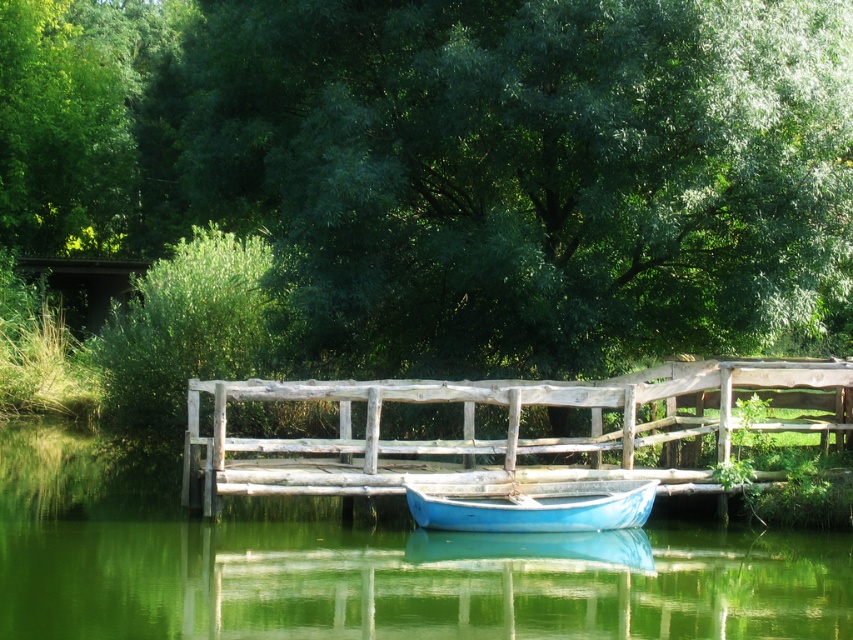
You are an artist planning to paint the scene. The green leafy tree at upper left and the matte blue boat at center are both in your view. Which object should you focus on first if you want to paint the larger one first?

The matte blue boat at center should be painted first because it occupies more space than the green leafy tree at upper left.

You are standing on the wooden bridge and looking down at the water. You see two points marked on the water surface. Which point is closer to you, point (135, 179) or point (508, 509)?

Point (135, 179) is closer to you because it is further to the viewer than point (508, 509).

You are an artist planning to paint the scene. You want to ensure the green leafy tree at upper center and the green leafy tree at upper left are proportionally accurate. Which tree should you draw wider in your painting?

The green leafy tree at upper center should be drawn wider because its width is larger than the green leafy tree at upper left.